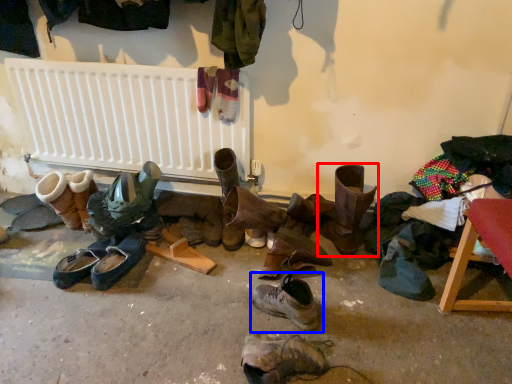
Question: Which object appears closest to the camera in this image, footwear (highlighted by a red box) or footwear (highlighted by a blue box)?

Choices:
 (A) footwear
 (B) footwear

Answer: (B)